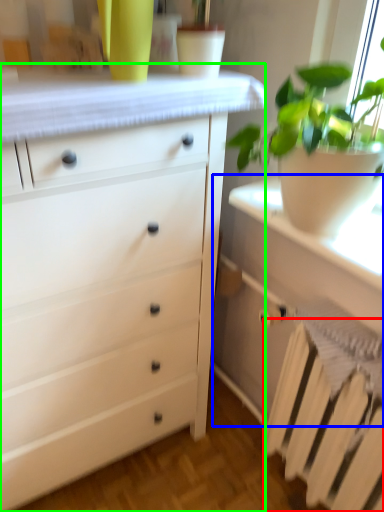
Question: Which object is positioned closest to radiator (highlighted by a red box)? Select from vanity (highlighted by a blue box) and chest of drawers (highlighted by a green box).

Choices:
 (A) vanity
 (B) chest of drawers

Answer: (A)